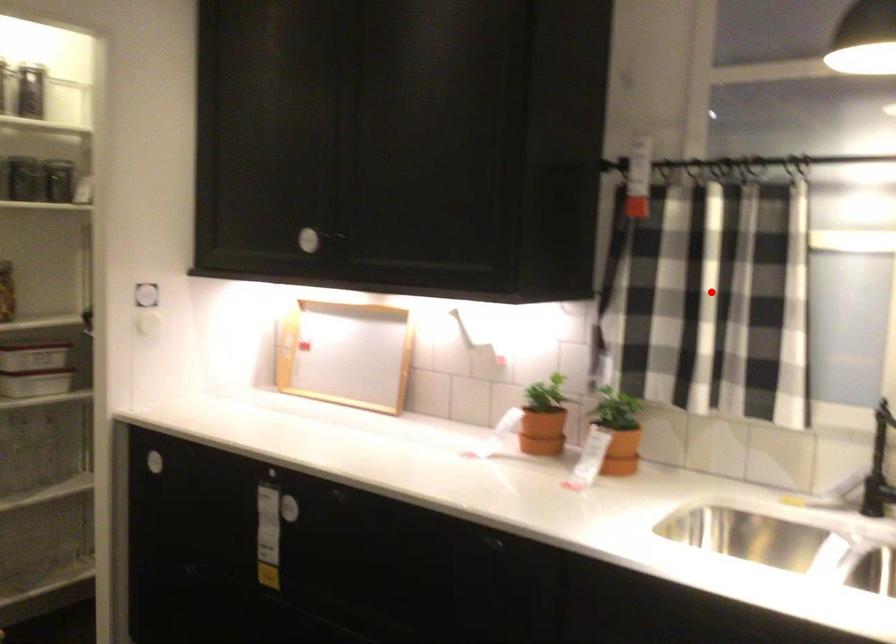
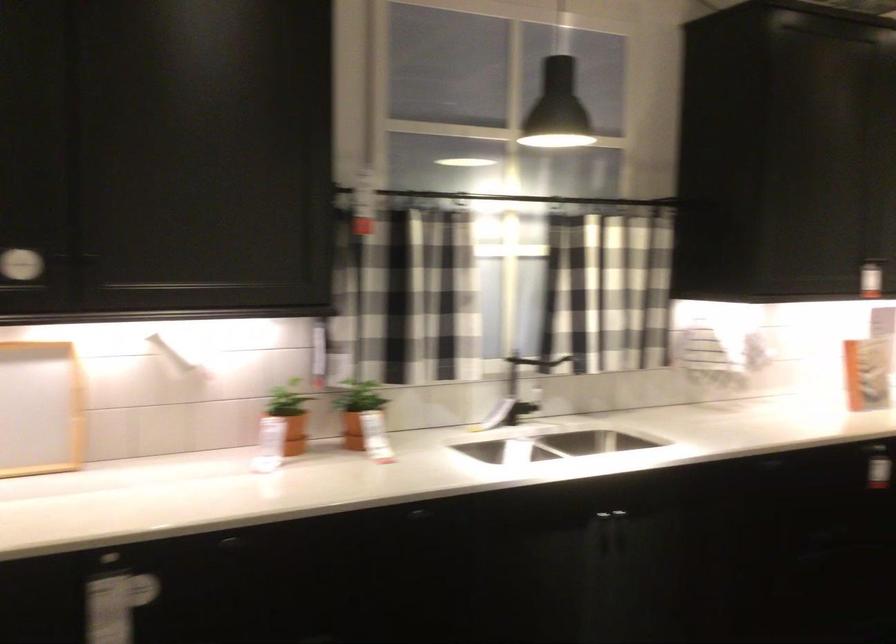
In the second image, find the point that corresponds to the highlighted location in the first image.

(403, 295)